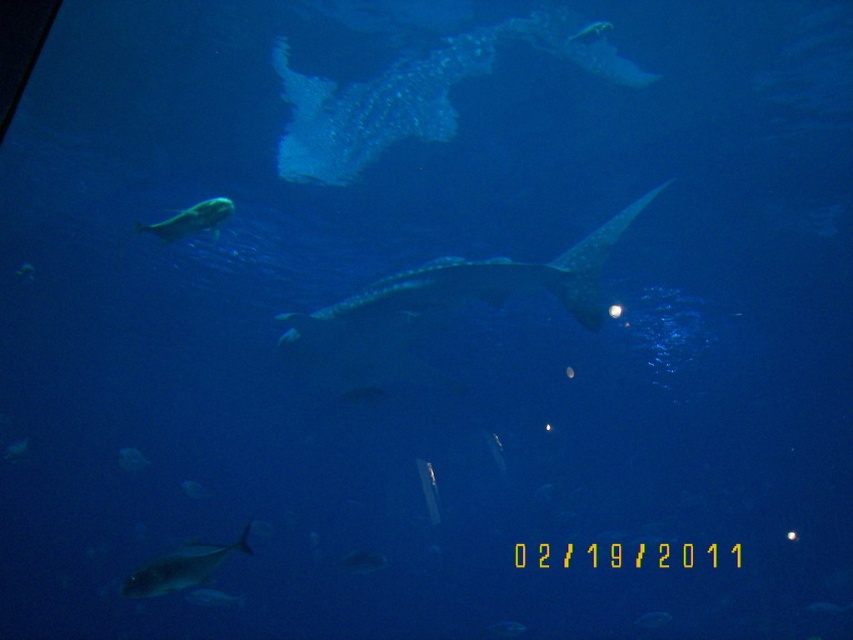
Question: Observing the image, what is the correct spatial positioning of translucent blue shark at center in reference to shiny silver fish at upper left?

Choices:
 (A) left
 (B) right

Answer: (B)

Question: Which is farther from the shiny silver fish at upper left?

Choices:
 (A) translucent blue fish at upper center
 (B) translucent blue shark at center
 (C) shiny silver fish at bottom left
 (D) shiny silver fish at center

Answer: (D)

Question: Does shiny silver fish at upper left appear on the right side of shiny silver fish at center?

Choices:
 (A) yes
 (B) no

Answer: (B)

Question: Which is farther from the shiny silver fish at upper left?

Choices:
 (A) translucent blue fish at upper center
 (B) translucent blue shark at center
 (C) shiny silver fish at bottom left
 (D) shiny silver fish at center

Answer: (D)

Question: Does shiny silver fish at upper left appear under translucent blue fish at upper center?

Choices:
 (A) yes
 (B) no

Answer: (A)

Question: Estimate the real-world distances between objects in this image. Which object is farther from the translucent blue shark at center?

Choices:
 (A) shiny silver fish at upper left
 (B) shiny silver fish at bottom left
 (C) shiny silver fish at center

Answer: (B)